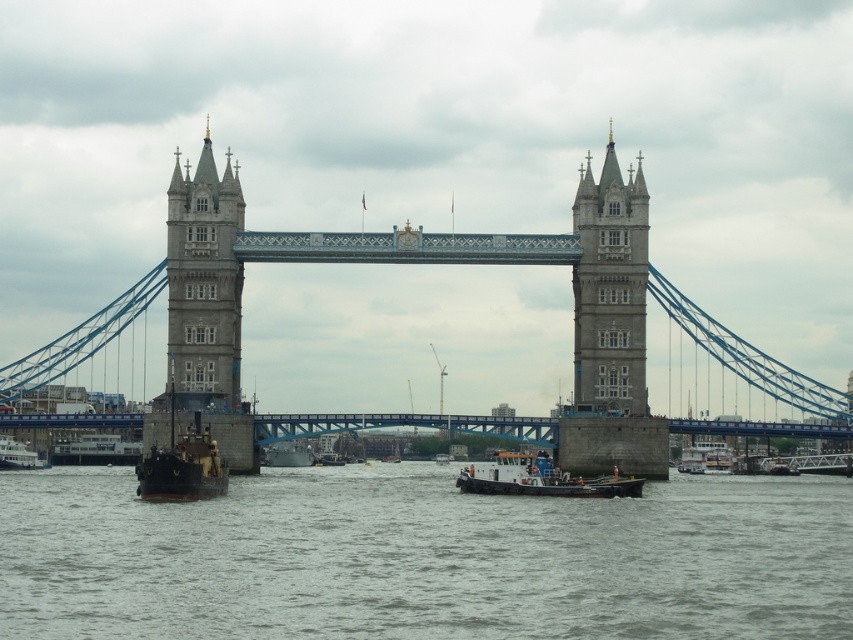
You are a tourist standing on the south bank of the River Thames, looking north towards Tower Bridge. You see the gray water at center and the stone bridge at center. Which object is positioned to the left when viewed from your perspective?

The gray water at center is to the left of the stone bridge at center from your perspective.

You are a tourist standing on the south bank of the River Thames, looking north toward Tower Bridge. You see the gray water at center and the stone bridge at center. Which object is closer to you?

The gray water at center is closer to you because it is in front of the stone bridge at center.